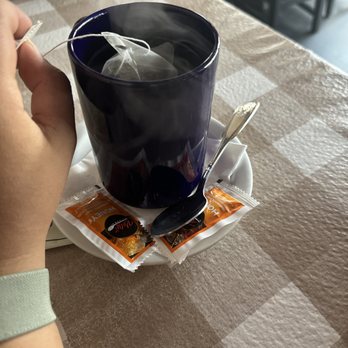
Identify the location of spoon. (191, 210).